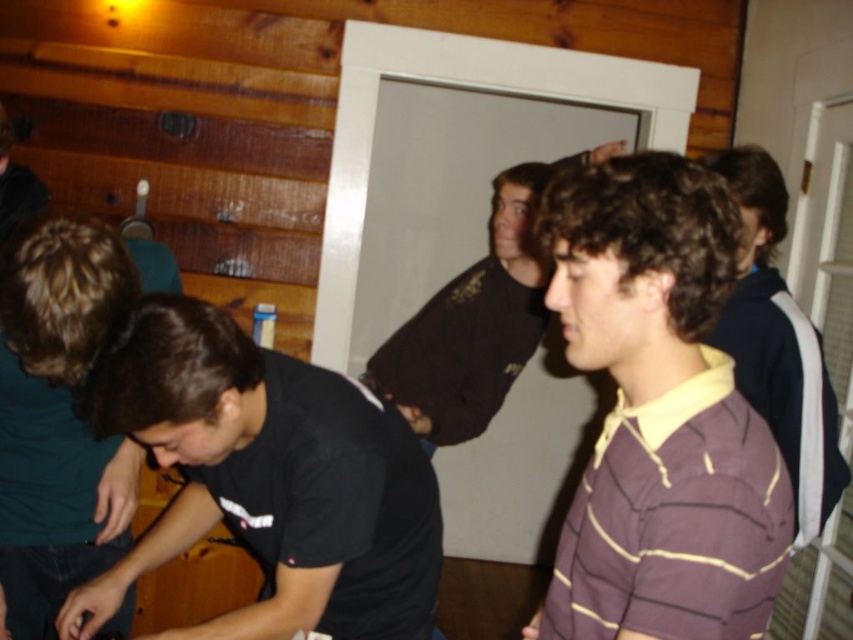
Question: Which object appears closest to the camera in this image?

Choices:
 (A) purple striped polo shirt at right
 (B) dark brown leather jacket at center

Answer: (A)

Question: Does purple striped polo shirt at center appear on the left side of purple striped polo shirt at right?

Choices:
 (A) no
 (B) yes

Answer: (B)

Question: Does purple striped polo shirt at center have a lesser width compared to black matte shirt at lower left?

Choices:
 (A) no
 (B) yes

Answer: (B)

Question: Which point is closer to the camera taking this photo?

Choices:
 (A) (491, 388)
 (B) (373, 422)

Answer: (B)

Question: Which point is farther to the camera?

Choices:
 (A) (730, 173)
 (B) (660, 292)

Answer: (A)

Question: Can you confirm if dark brown leather jacket at center is positioned to the left of purple striped polo shirt at right?

Choices:
 (A) no
 (B) yes

Answer: (B)